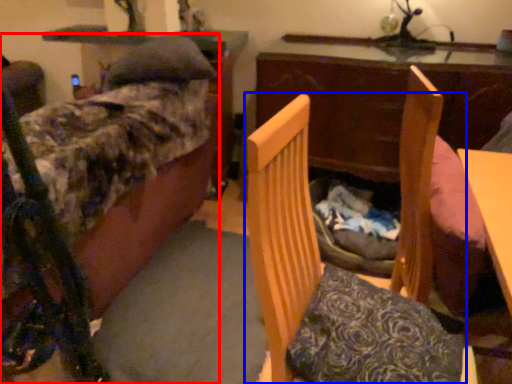
Question: Among these objects, which one is nearest to the camera, furniture (highlighted by a red box) or furniture (highlighted by a blue box)?

Choices:
 (A) furniture
 (B) furniture

Answer: (B)